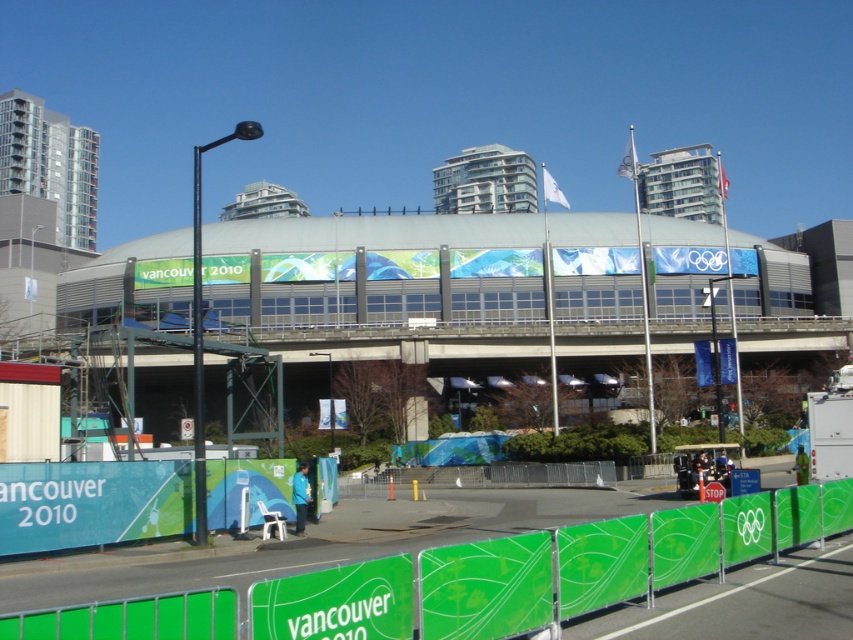
You are a photographer trying to capture the Vancouver 2010 Winter Olympics scene. You notice two green fabrics in the foreground. Which one is wider between the green fabric barrier at lower center and the green fabric at lower center?

The green fabric barrier at lower center is wider than the green fabric at lower center.

You are a spectator at the Vancouver 2010 Winter Olympics and want to see the green fabric barrier at lower center and the green fabric at lower center. Which one is taller?

The green fabric barrier at lower center is much taller than the green fabric at lower center.